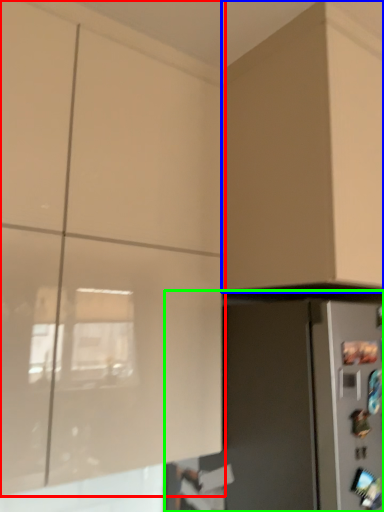
Question: Which object is positioned closest to cabinetry (highlighted by a red box)? Select from cabinetry (highlighted by a blue box) and appliance (highlighted by a green box).

Choices:
 (A) cabinetry
 (B) appliance

Answer: (B)